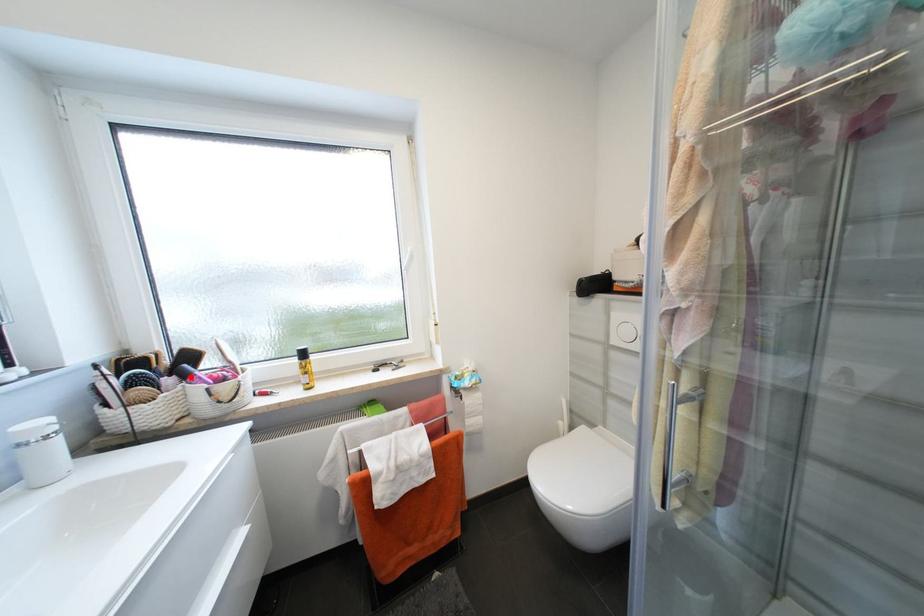
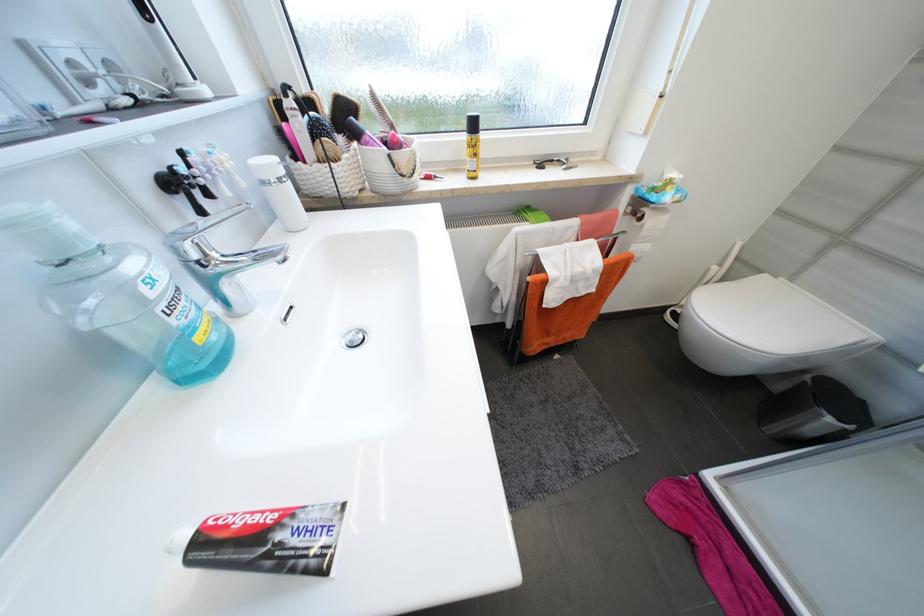
Find the pixel in the second image that matches the highlighted location in the first image.

(362, 136)